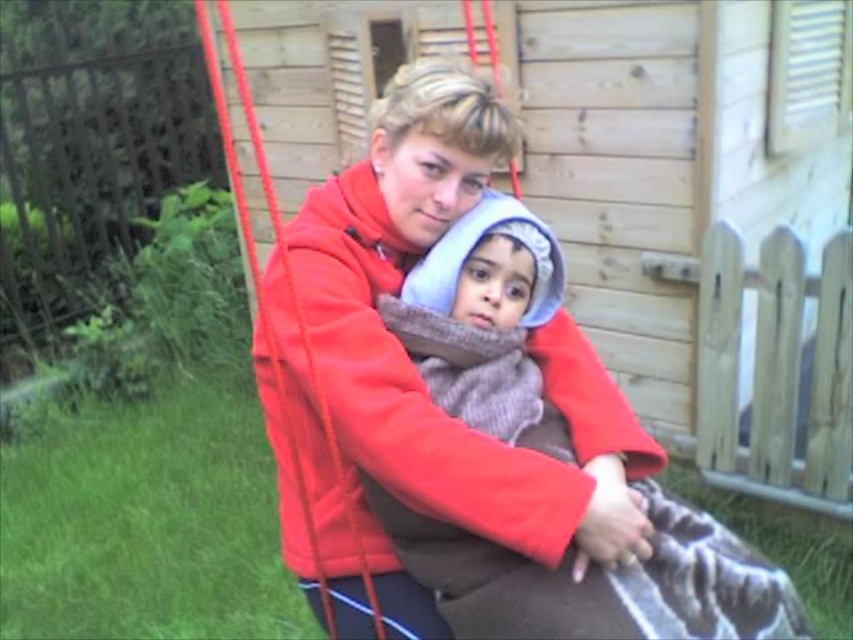
Who is more forward, (314,300) or (471,625)?

Point (471,625) is in front.

Describe the element at coordinates (418, 372) in the screenshot. I see `matte fleece jacket at center` at that location.

Locate an element on the screen. This screenshot has width=853, height=640. matte fleece jacket at center is located at coordinates (418, 372).